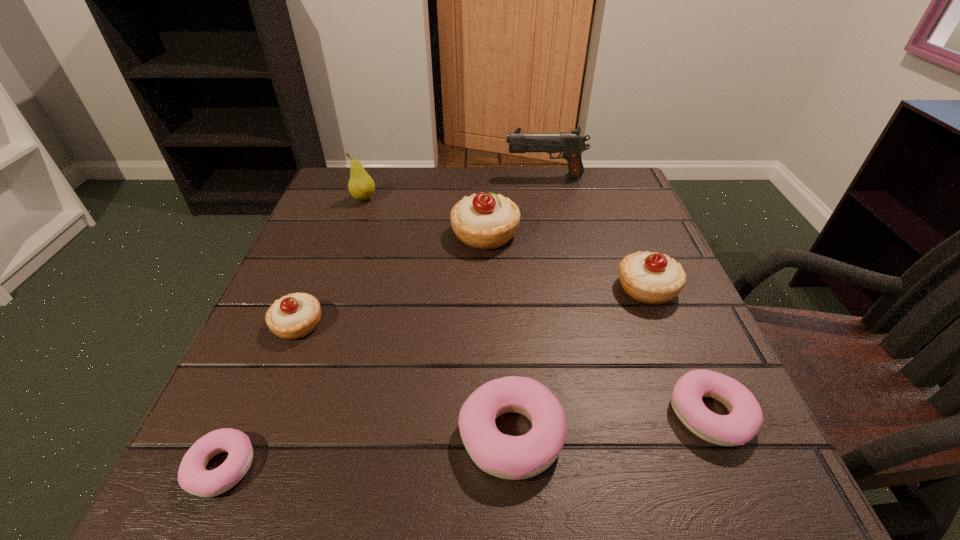
Identify the location of the second pink pastry from left to right. (509, 457).

You are a GUI agent. You are given a task and a screenshot of the screen. Output one action in this format:
    pyautogui.click(x=<x>, y=<y>)
    Task: Click on the second smallest pink pastry
    Image resolution: width=960 pixels, height=540 pixels.
    Given the screenshot: What is the action you would take?
    pyautogui.click(x=745, y=419)

Identify the location of the rightmost pink pastry. (745, 419).

Locate an element on the screen. the leftmost pink pastry is located at coordinates (193, 477).

This screenshot has height=540, width=960. I want to click on the shortest object, so click(x=193, y=477).

I want to click on free point located in the direction the farthest object is aimed, so click(483, 176).

I want to click on vacant region located in the direction the farthest object is aimed, so click(355, 176).

You are a GUI agent. You are given a task and a screenshot of the screen. Output one action in this format:
    pyautogui.click(x=<x>, y=<y>)
    Task: Click on the free location located in the direction the farthest object is aimed
    This screenshot has width=960, height=540.
    Given the screenshot: What is the action you would take?
    pyautogui.click(x=411, y=176)

Identify the location of vacant position located on the right of the pear. (417, 199).

The image size is (960, 540). I want to click on free space located 0.070m on the front of the biggest beige pastry, so click(486, 278).